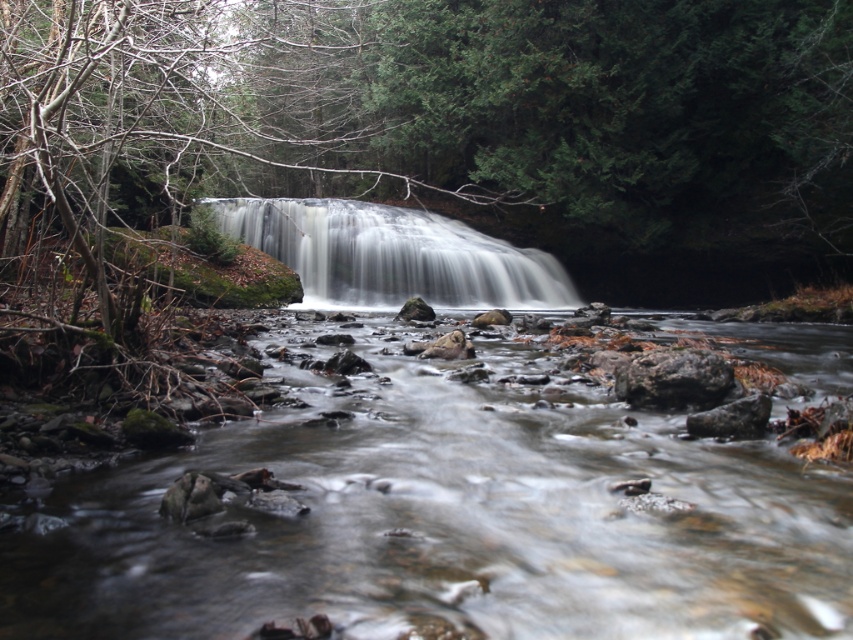
You are standing at the edge of the stream and want to cross to the other side. You notice the white smooth waterfall at center and the rough textured rock at center. Which object is taller and could potentially block your path if you try to cross directly below it?

The white smooth waterfall at center is taller than the rough textured rock at center, so it could potentially block your path if you try to cross directly below it.

You are a hiker who wants to cross the stream. You see the clear water at center and the white smooth waterfall at center. How far apart are these two landmarks?

The clear water at center is 7.50 meters away from the white smooth waterfall at center.